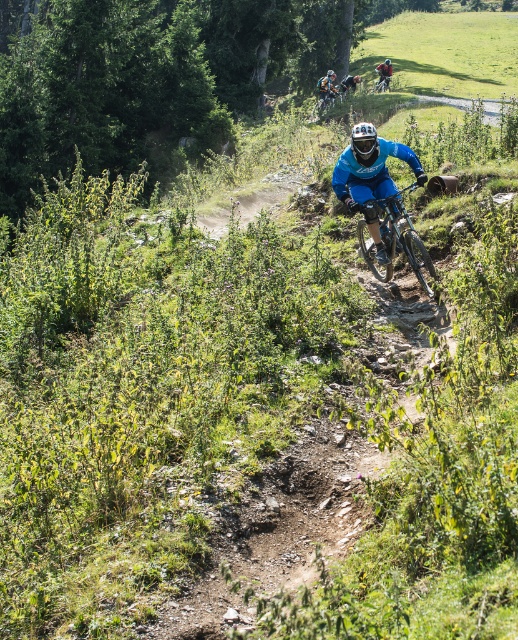
You are a photographer planning to capture the blue matte bicycle at center and the blue matte helmet at upper center in a single shot. Based on their sizes in the image, which object would appear closer to the camera?

The blue matte helmet at upper center appears larger in the image, so it is closer to the camera than the blue matte bicycle at center.

You are a mountain biker preparing to ride down the trail. You notice the shiny blue frame at center and the blue matte helmet at upper center. Which object is smaller in size?

The shiny blue frame at center is smaller in size compared to the blue matte helmet at upper center.

You are planning a mountain biking route and need to ensure your blue matte bicycle at center can navigate the trail safely. Given the trail has a dirt surface with rocks and uneven terrain, will the bicycle handle this terrain based on its description?

The blue matte bicycle at center is designed for mountain biking, as indicated by its presence in the scene with appropriate terrain. It should handle the dirt surface with rocks and uneven terrain effectively.